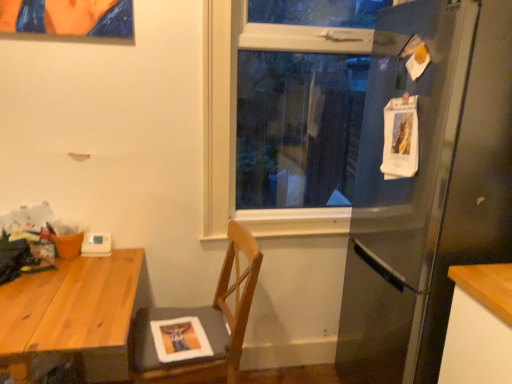
At what (x,y) coordinates should I click in order to perform the action: click on vacant area that is in front of white plastic thermostat at upper left. Please return your answer as a coordinate pair (x, y). The width and height of the screenshot is (512, 384). Looking at the image, I should click on (91, 266).